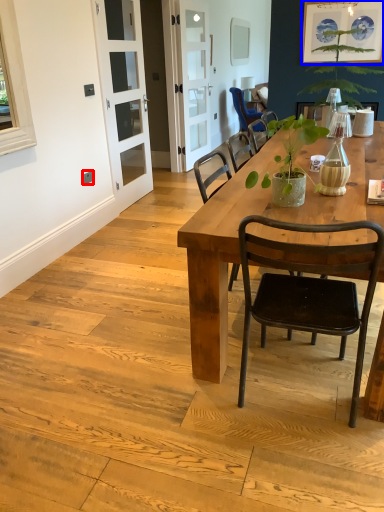
Question: Which object appears farthest to the camera in this image, power outlet (highlighted by a red box) or picture frame (highlighted by a blue box)?

Choices:
 (A) power outlet
 (B) picture frame

Answer: (B)